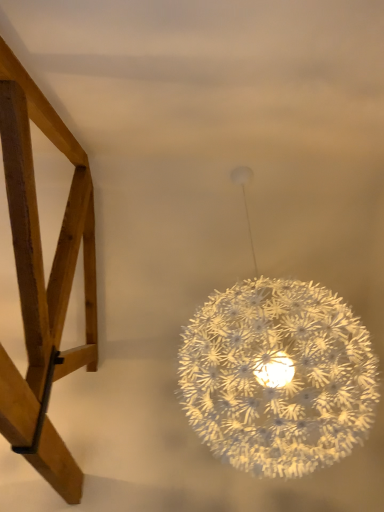
This screenshot has height=512, width=384. Describe the element at coordinates (43, 275) in the screenshot. I see `wooden chair at left` at that location.

The width and height of the screenshot is (384, 512). I want to click on wooden chair at left, so click(x=43, y=275).

Image resolution: width=384 pixels, height=512 pixels. What do you see at coordinates (277, 374) in the screenshot? I see `white textured sphere at upper center` at bounding box center [277, 374].

Find the location of `white textured sphere at upper center`. white textured sphere at upper center is located at coordinates 277,374.

Measure the distance between point [181,397] and camera.

Point [181,397] is 8.49 feet from camera.

In order to click on wooden chair at left in this screenshot , I will do `click(43, 275)`.

Based on their positions, is wooden chair at left located to the left or right of white textured sphere at upper center?

Based on their positions, wooden chair at left is located to the left of white textured sphere at upper center.

Based on the photo, considering the positions of objects wooden chair at left and white textured sphere at upper center in the image provided, who is behind, wooden chair at left or white textured sphere at upper center?

white textured sphere at upper center is further from the camera.

Considering the positions of point (81, 213) and point (192, 422), is point (81, 213) closer or farther from the camera than point (192, 422)?

Point (81, 213) appears to be farther away from the viewer than point (192, 422).

From the image's perspective, which is above, wooden chair at left or white textured sphere at upper center?

wooden chair at left appears higher in the image.

From a real-world perspective, is wooden chair at left positioned under white textured sphere at upper center based on gravity?

Incorrect, from a real-world perspective, wooden chair at left is higher than white textured sphere at upper center.

Considering the sizes of objects wooden chair at left and white textured sphere at upper center in the image provided, who is thinner, wooden chair at left or white textured sphere at upper center?

Thinner between the two is white textured sphere at upper center.

Looking at this image, in terms of height, does wooden chair at left look taller or shorter compared to white textured sphere at upper center?

Considering their sizes, wooden chair at left has less height than white textured sphere at upper center.

Considering the sizes of wooden chair at left and white textured sphere at upper center in the image, is wooden chair at left bigger or smaller than white textured sphere at upper center?

Clearly, wooden chair at left is smaller in size than white textured sphere at upper center.

Would you say wooden chair at left is inside or outside white textured sphere at upper center?

The correct answer is: outside.

Are wooden chair at left and white textured sphere at upper center far apart?

Actually, wooden chair at left and white textured sphere at upper center are a little close together.

Is white textured sphere at upper center at the back of wooden chair at left?

No, wooden chair at left is not facing the opposite direction of white textured sphere at upper center.

How different are the orientations of wooden chair at left and white textured sphere at upper center in degrees?

180 degrees.

Locate an element on the screen. The height and width of the screenshot is (512, 384). lamp lying on the right of wooden chair at left is located at coordinates tap(277, 374).

Is white textured sphere at upper center to the left or to the right of wooden chair at left in the image?

Clearly, white textured sphere at upper center is on the right of wooden chair at left in the image.

From the picture: Relative to wooden chair at left, is white textured sphere at upper center in front or behind?

In the image, white textured sphere at upper center appears behind wooden chair at left.

Which point is more distant from viewer, (327, 398) or (17, 66)?

The point (327, 398) is farther from the camera.

From the image's perspective, is white textured sphere at upper center on top of wooden chair at left?

No.

From a real-world perspective, who is located lower, white textured sphere at upper center or wooden chair at left?

white textured sphere at upper center, from a real-world perspective.

Is white textured sphere at upper center thinner than wooden chair at left?

Correct, the width of white textured sphere at upper center is less than that of wooden chair at left.

Which of these two, white textured sphere at upper center or wooden chair at left, stands taller?

white textured sphere at upper center is taller.

Who is bigger, white textured sphere at upper center or wooden chair at left?

With larger size is white textured sphere at upper center.

Choose the correct answer: Is white textured sphere at upper center inside wooden chair at left or outside it?

white textured sphere at upper center is located beyond the bounds of wooden chair at left.

Is white textured sphere at upper center not near wooden chair at left?

No, there isn't a large distance between white textured sphere at upper center and wooden chair at left.

Is white textured sphere at upper center positioned with its back to wooden chair at left?

white textured sphere at upper center does not have its back to wooden chair at left.

How many degrees apart are the facing directions of white textured sphere at upper center and wooden chair at left?

They differ by 180 degrees in their facing directions.

This screenshot has width=384, height=512. Identify the location of furniture on the left of white textured sphere at upper center. (43, 275).

Identify the location of furniture on the left of white textured sphere at upper center. The image size is (384, 512). (43, 275).

At what (x,y) coordinates should I click in order to perform the action: click on lamp below the wooden chair at left (from the image's perspective). Please return your answer as a coordinate pair (x, y). This screenshot has width=384, height=512. Looking at the image, I should click on (277, 374).